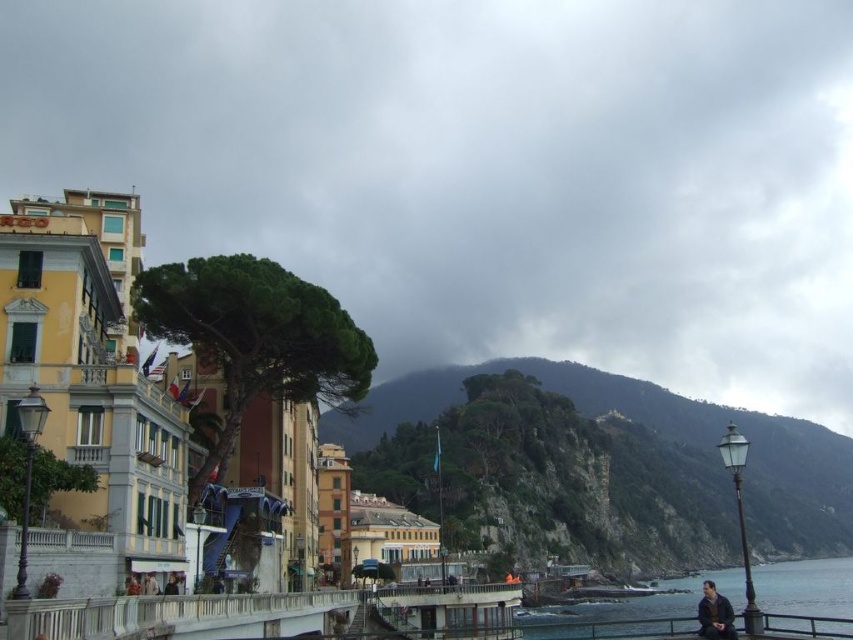
Question: Based on their relative distances, which object is farther from the blue water at lower right?

Choices:
 (A) dark blue fabric jacket at lower center
 (B) dark brown leather jacket at lower right

Answer: (A)

Question: Can you confirm if blue water at lower right is positioned to the left of dark brown leather jacket at lower right?

Choices:
 (A) no
 (B) yes

Answer: (A)

Question: Where is blue water at lower right located in relation to dark brown leather jacket at lower right in the image?

Choices:
 (A) above
 (B) below

Answer: (B)

Question: Which is farther from the blue water at lower right?

Choices:
 (A) dark brown leather jacket at lower right
 (B) dark blue fabric jacket at lower center

Answer: (B)

Question: Is blue water at lower right in front of dark blue fabric jacket at lower center?

Choices:
 (A) yes
 (B) no

Answer: (A)

Question: Among these objects, which one is farthest from the camera?

Choices:
 (A) dark brown leather jacket at lower right
 (B) blue water at lower right

Answer: (A)